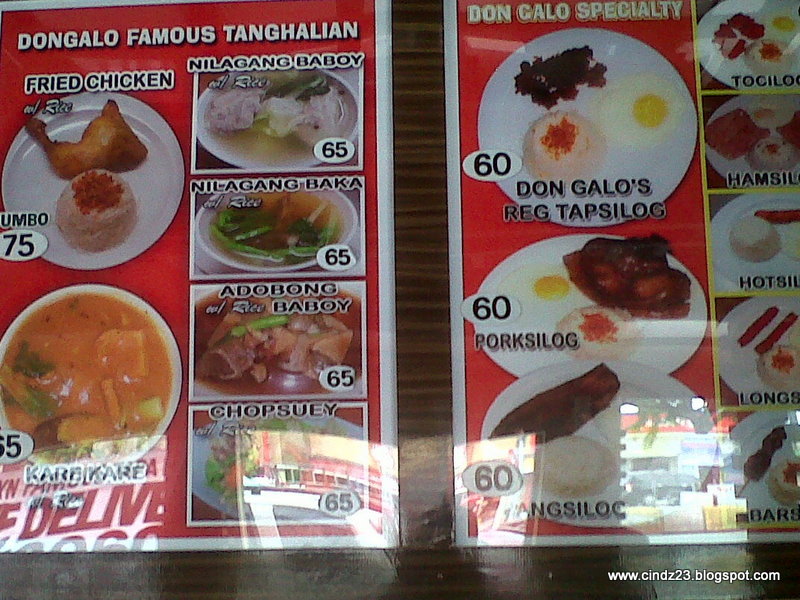
Image resolution: width=800 pixels, height=600 pixels. I want to click on grain lines in the table, so click(x=417, y=297), click(x=416, y=284), click(x=417, y=256), click(x=418, y=234), click(x=416, y=216).